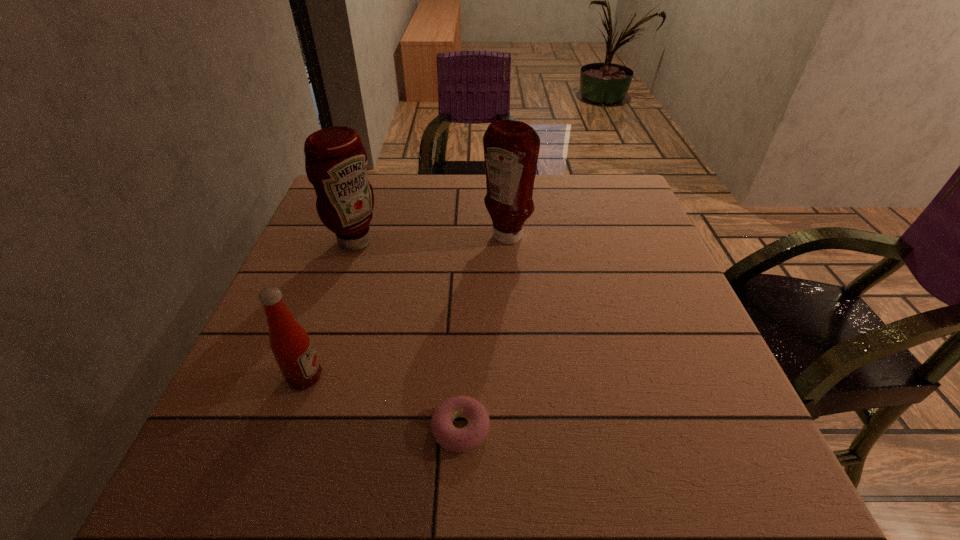
Where is `the rightmost condiment`? the rightmost condiment is located at coordinates 511,148.

In order to click on the shortest condiment in this screenshot , I will do `click(289, 341)`.

Find the location of a particular element. the third tallest object is located at coordinates (289, 341).

At what (x,y) coordinates should I click in order to perform the action: click on the shortest object. Please return your answer as a coordinate pair (x, y). Image resolution: width=960 pixels, height=540 pixels. Looking at the image, I should click on (453, 439).

You are a GUI agent. You are given a task and a screenshot of the screen. Output one action in this format:
    pyautogui.click(x=<x>, y=<y>)
    Task: Click on the nearest object
    
    Given the screenshot: What is the action you would take?
    pyautogui.click(x=453, y=439)

Image resolution: width=960 pixels, height=540 pixels. I want to click on vacant space located 0.200m on the back of the rightmost condiment, so click(x=503, y=187).

What are the coordinates of `free space located 0.160m on the front-facing side of the nearest condiment` in the screenshot? It's located at (411, 377).

Identify the location of free space located on the left of the shortest object. (249, 428).

Where is `object at the near edge`? Image resolution: width=960 pixels, height=540 pixels. object at the near edge is located at coordinates (453, 439).

Find the location of a particular element. The height and width of the screenshot is (540, 960). free point at the far edge is located at coordinates [x=556, y=179].